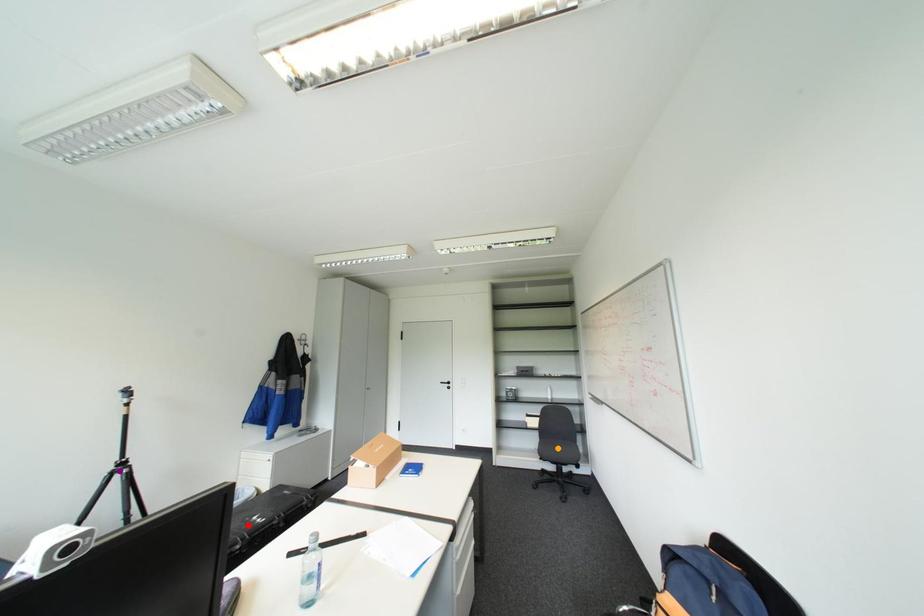
Order these from nearest to farthest:
A) orange point
B) red point
C) purple point

purple point, red point, orange point